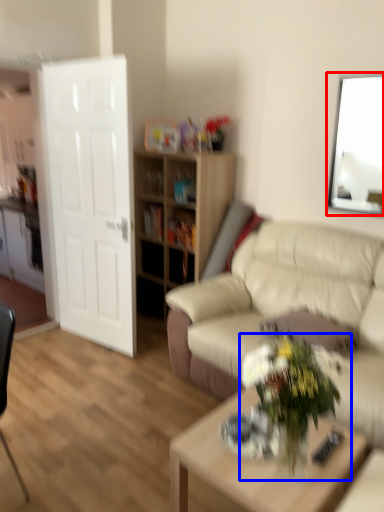
Question: Which of the following is the closest to the observer, picture frame (highlighted by a red box) or houseplant (highlighted by a blue box)?

Choices:
 (A) picture frame
 (B) houseplant

Answer: (B)